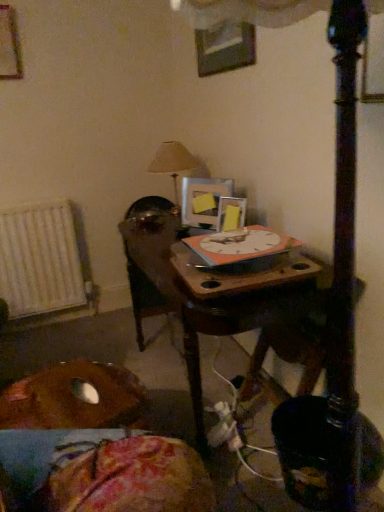
What are the coordinates of `free space to the left of yellow matte picture frame at upper center, which is the 2th picture frame in left-to-right order` in the screenshot? It's located at (185, 230).